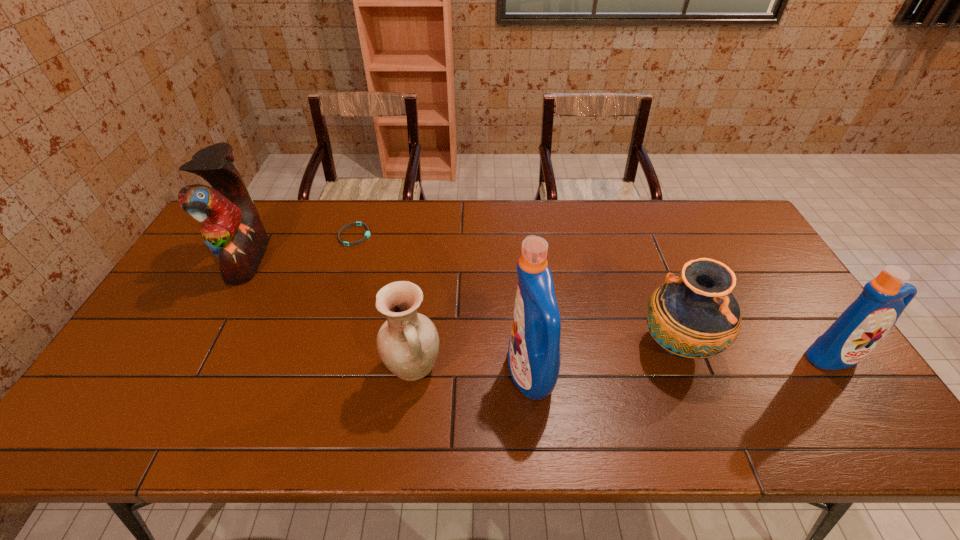
Please point out where to position a new detergent on the left to maintain spacing. Please provide its 2D coordinates. Your answer should be formatted as a tuple, i.e. [(x, y)], where the tuple contains the x and y coordinates of a point satisfying the conditions above.

[(204, 394)]